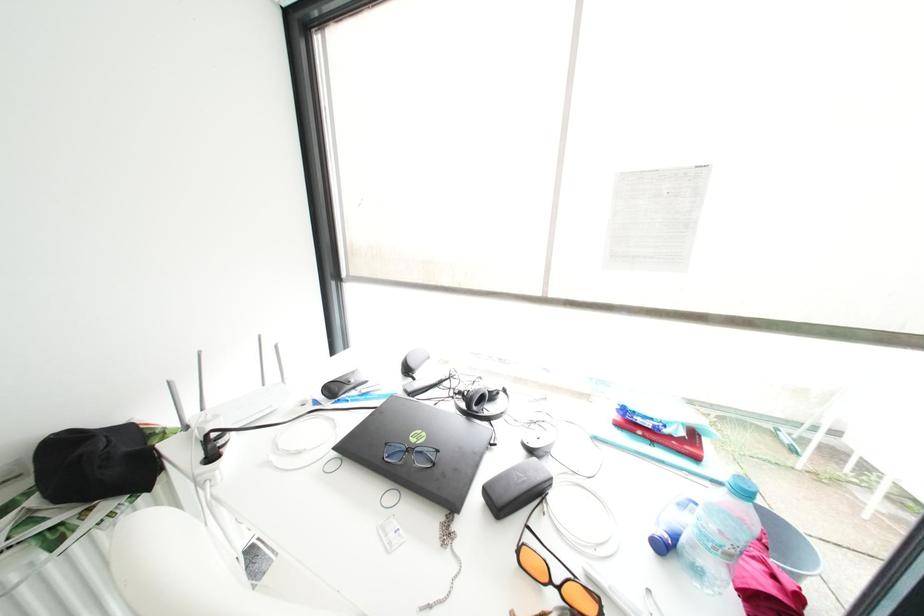
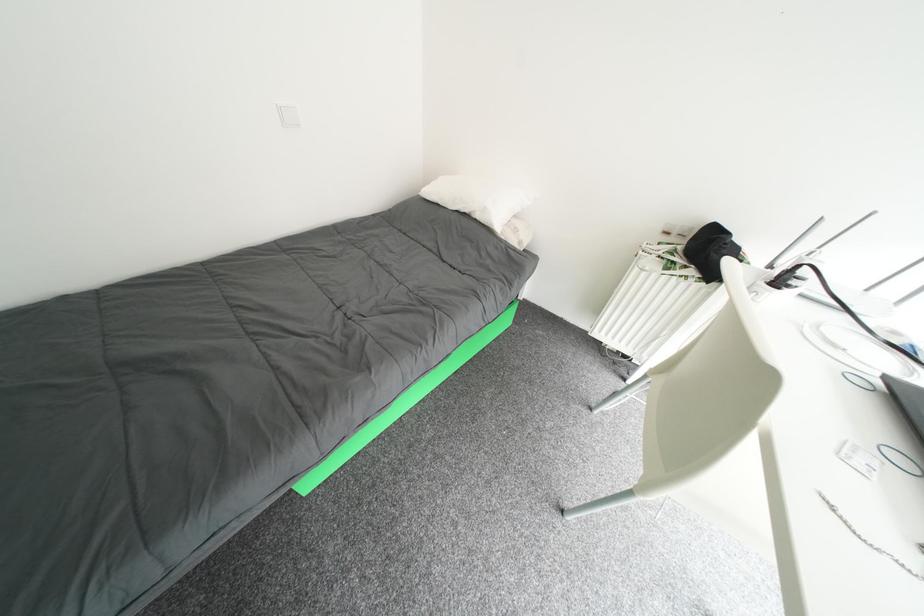
First-person continuous shooting, in which direction is the camera rotating?

The camera rotated toward left-down.